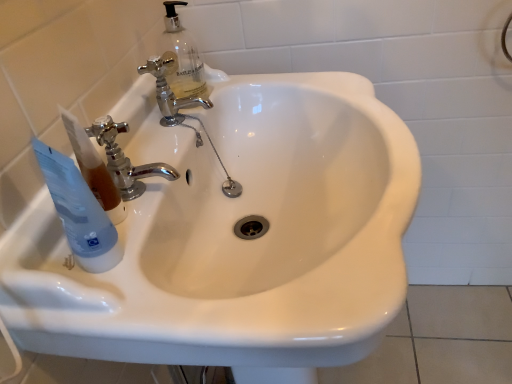
I want to click on chrome metallic faucet at center, which ranks as the 1th tap in back-to-front order, so click(170, 90).

What is the approximate height of chrome metallic faucet at center, the 2th tap from the front?

4.59 inches.

This screenshot has width=512, height=384. What do you see at coordinates (125, 160) in the screenshot?
I see `chrome metallic faucet at upper left, arranged as the 1th tap when viewed from the front` at bounding box center [125, 160].

Measure the distance between point (160, 344) and camera.

Point (160, 344) is 16.10 inches from camera.

Describe the element at coordinates (234, 237) in the screenshot. I see `white glossy sink at center` at that location.

Describe the element at coordinates (79, 212) in the screenshot. I see `transparent plastic tube at left` at that location.

Image resolution: width=512 pixels, height=384 pixels. What are the coordinates of `chrome metallic faucet at center, the 2th tap from the front` in the screenshot? It's located at (170, 90).

Looking at this image, how many degrees apart are the facing directions of white glossy sink at center and chrome metallic faucet at upper left, arranged as the 1th tap when viewed from the front?

white glossy sink at center and chrome metallic faucet at upper left, arranged as the 1th tap when viewed from the front, are facing 7.39 degrees away from each other.

From a real-world perspective, does white glossy sink at center sit lower than chrome metallic faucet at upper left, the second tap positioned from the top?

Indeed, from a real-world perspective, white glossy sink at center is positioned beneath chrome metallic faucet at upper left, the second tap positioned from the top.

Does white glossy sink at center have a smaller size compared to chrome metallic faucet at upper left, arranged as the second tap when viewed from the back?

No.

Which is farther, (x=369, y=90) or (x=120, y=171)?

Point (x=369, y=90)

Is transparent plastic tube at left far from chrome metallic faucet at upper left, which is the 1th tap from bottom to top?

No.

How far apart are transparent plastic tube at left and chrome metallic faucet at upper left, arranged as the second tap when viewed from the back?

The distance of transparent plastic tube at left from chrome metallic faucet at upper left, arranged as the second tap when viewed from the back, is 4.85 inches.

Is transparent plastic tube at left aimed at chrome metallic faucet at upper left, arranged as the second tap when viewed from the back?

No, transparent plastic tube at left is not facing towards chrome metallic faucet at upper left, arranged as the second tap when viewed from the back.

From the image's perspective, is transparent plastic tube at left above or below chrome metallic faucet at upper left, arranged as the second tap when viewed from the back?

Clearly, from the image's perspective, transparent plastic tube at left is below chrome metallic faucet at upper left, arranged as the second tap when viewed from the back.

Measure the distance between chrome metallic faucet at center, the 2th tap from the front, and chrome metallic faucet at upper left, the second tap positioned from the top.

14.70 centimeters.

From their relative heights in the image, would you say chrome metallic faucet at center, the second tap in the bottom-to-top sequence, is taller or shorter than chrome metallic faucet at upper left, which is the 1th tap from bottom to top?

Clearly, chrome metallic faucet at center, the second tap in the bottom-to-top sequence, is taller compared to chrome metallic faucet at upper left, which is the 1th tap from bottom to top.

From a real-world perspective, which object stands above the other?

From a 3D spatial view, chrome metallic faucet at upper left, which is the 1th tap from bottom to top, is above.

Is chrome metallic faucet at upper left, the second tap positioned from the top, at the back of chrome metallic faucet at center, the 2th tap from the front?

chrome metallic faucet at center, the 2th tap from the front, does not have its back to chrome metallic faucet at upper left, the second tap positioned from the top.

Is transparent plastic tube at left positioned beyond the bounds of chrome metallic faucet at center, the second tap in the bottom-to-top sequence?

Yes, transparent plastic tube at left is outside of chrome metallic faucet at center, the second tap in the bottom-to-top sequence.

Considering the relative sizes of transparent plastic tube at left and chrome metallic faucet at center, the first tap from the top, in the image provided, is transparent plastic tube at left wider than chrome metallic faucet at center, the first tap from the top,?

Yes, transparent plastic tube at left is wider than chrome metallic faucet at center, the first tap from the top.

From a real-world perspective, which object rests below the other?

chrome metallic faucet at center, which ranks as the 1th tap in back-to-front order, from a real-world perspective.

Looking at this image, is white glossy sink at center situated inside chrome metallic faucet at center, which ranks as the 1th tap in back-to-front order, or outside?

white glossy sink at center is not enclosed by chrome metallic faucet at center, which ranks as the 1th tap in back-to-front order.

Is white glossy sink at center bigger than chrome metallic faucet at center, the second tap in the bottom-to-top sequence?

Yes, white glossy sink at center is bigger than chrome metallic faucet at center, the second tap in the bottom-to-top sequence.

Is white glossy sink at center positioned with its back to chrome metallic faucet at center, the second tap in the bottom-to-top sequence?

No, chrome metallic faucet at center, the second tap in the bottom-to-top sequence, is not at the back of white glossy sink at center.

Between white glossy sink at center and chrome metallic faucet at center, which ranks as the 1th tap in back-to-front order, which one appears on the left side from the viewer's perspective?

From the viewer's perspective, chrome metallic faucet at center, which ranks as the 1th tap in back-to-front order, appears more on the left side.

Is transparent plastic tube at left at the back of chrome metallic faucet at upper left, arranged as the 1th tap when viewed from the front?

No, chrome metallic faucet at upper left, arranged as the 1th tap when viewed from the front, is not facing the opposite direction of transparent plastic tube at left.

Is chrome metallic faucet at upper left, arranged as the second tap when viewed from the back, shorter than transparent plastic tube at left?

Indeed, chrome metallic faucet at upper left, arranged as the second tap when viewed from the back, has a lesser height compared to transparent plastic tube at left.

Measure the distance from chrome metallic faucet at upper left, arranged as the second tap when viewed from the back, to transparent plastic tube at left.

chrome metallic faucet at upper left, arranged as the second tap when viewed from the back, is 4.85 inches away from transparent plastic tube at left.

From the image's perspective, between chrome metallic faucet at center, the first tap from the top, and white glossy sink at center, who is located below?

white glossy sink at center appears lower in the image.

How different are the orientations of chrome metallic faucet at center, the second tap in the bottom-to-top sequence, and white glossy sink at center in degrees?

7.39 degrees.

Considering the relative sizes of chrome metallic faucet at center, the 2th tap from the front, and white glossy sink at center in the image provided, is chrome metallic faucet at center, the 2th tap from the front, smaller than white glossy sink at center?

Correct, chrome metallic faucet at center, the 2th tap from the front, occupies less space than white glossy sink at center.

Is chrome metallic faucet at center, the 2th tap from the front, next to white glossy sink at center?

No.

Image resolution: width=512 pixels, height=384 pixels. Find the location of `tap that is the 1st one when counting backward from the white glossy sink at center`. tap that is the 1st one when counting backward from the white glossy sink at center is located at coordinates (125, 160).

The width and height of the screenshot is (512, 384). What are the coordinates of `mouthwash in front of the chrome metallic faucet at upper left, arranged as the 1th tap when viewed from the front` in the screenshot? It's located at (79, 212).

From the image, which object appears to be nearer to white glossy sink at center, chrome metallic faucet at center, the first tap from the top, or transparent plastic tube at left?

Based on the image, chrome metallic faucet at center, the first tap from the top, appears to be nearer to white glossy sink at center.

Estimate the real-world distances between objects in this image. Which object is further from chrome metallic faucet at upper left, arranged as the 1th tap when viewed from the front, white glossy sink at center or transparent plastic tube at left?

white glossy sink at center lies further to chrome metallic faucet at upper left, arranged as the 1th tap when viewed from the front, than the other object.

Consider the image. Which object lies nearer to the anchor point chrome metallic faucet at upper left, which is the 1th tap from bottom to top, white glossy sink at center or chrome metallic faucet at center, which ranks as the 1th tap in back-to-front order?

chrome metallic faucet at center, which ranks as the 1th tap in back-to-front order, lies closer to chrome metallic faucet at upper left, which is the 1th tap from bottom to top, than the other object.

Estimate the real-world distances between objects in this image. Which object is closer to chrome metallic faucet at upper left, which is the 1th tap from bottom to top, transparent plastic tube at left or chrome metallic faucet at center, the first tap from the top?

transparent plastic tube at left is positioned closer to the anchor chrome metallic faucet at upper left, which is the 1th tap from bottom to top.

Estimate the real-world distances between objects in this image. Which object is closer to transparent plastic tube at left, chrome metallic faucet at upper left, which is the 1th tap from bottom to top, or white glossy sink at center?

chrome metallic faucet at upper left, which is the 1th tap from bottom to top, is positioned closer to the anchor transparent plastic tube at left.

Which object lies nearer to the anchor point chrome metallic faucet at upper left, the second tap positioned from the top, transparent plastic tube at left or white glossy sink at center?

Among the two, transparent plastic tube at left is located nearer to chrome metallic faucet at upper left, the second tap positioned from the top.

When comparing their distances from chrome metallic faucet at upper left, arranged as the second tap when viewed from the back, does chrome metallic faucet at center, the first tap from the top, or white glossy sink at center seem further?

The object further to chrome metallic faucet at upper left, arranged as the second tap when viewed from the back, is white glossy sink at center.

Looking at the image, which one is located closer to white glossy sink at center, chrome metallic faucet at upper left, the second tap positioned from the top, or chrome metallic faucet at center, the first tap from the top?

chrome metallic faucet at upper left, the second tap positioned from the top, lies closer to white glossy sink at center than the other object.

The image size is (512, 384). Find the location of `mouthwash that lies between chrome metallic faucet at upper left, which is the 1th tap from bottom to top, and white glossy sink at center from top to bottom`. mouthwash that lies between chrome metallic faucet at upper left, which is the 1th tap from bottom to top, and white glossy sink at center from top to bottom is located at coordinates (79, 212).

Locate an element on the screen. This screenshot has height=384, width=512. mouthwash between chrome metallic faucet at center, the second tap in the bottom-to-top sequence, and white glossy sink at center from top to bottom is located at coordinates (79, 212).

Image resolution: width=512 pixels, height=384 pixels. Identify the location of tap between chrome metallic faucet at center, the first tap from the top, and white glossy sink at center in the up-down direction. (125, 160).

At what (x,y) coordinates should I click in order to perform the action: click on tap between transparent plastic tube at left and chrome metallic faucet at center, the 2th tap from the front, from front to back. Please return your answer as a coordinate pair (x, y). Looking at the image, I should click on (125, 160).